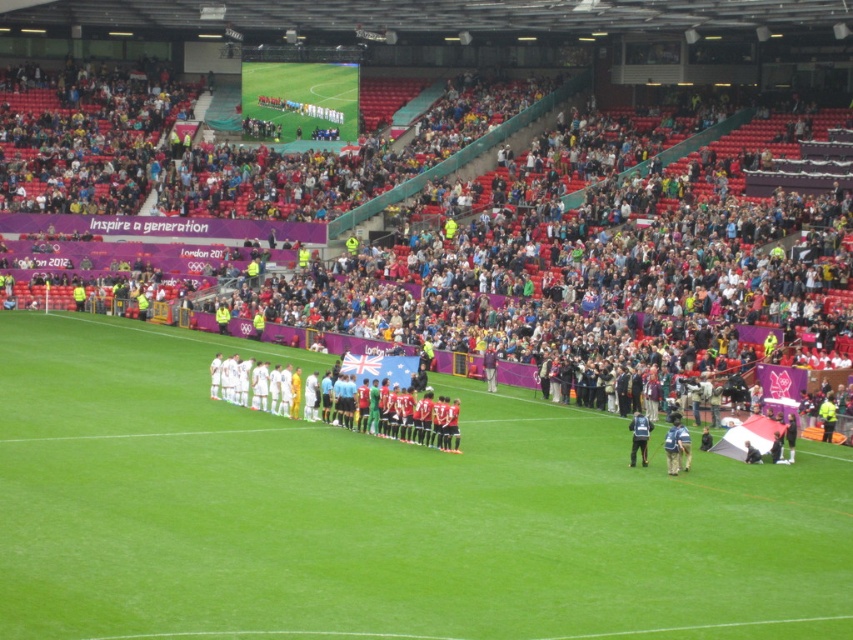
Question: Does green grass football field at center appear under camouflage pants at center?

Choices:
 (A) yes
 (B) no

Answer: (B)

Question: In this image, where is green grass football field at center located relative to camouflage pants at center?

Choices:
 (A) below
 (B) above

Answer: (B)

Question: Which of these objects is positioned closest to the camouflage pants at center?

Choices:
 (A) green grass football field at center
 (B) dark blue backpack at lower right

Answer: (B)

Question: Which object is farther from the camera taking this photo?

Choices:
 (A) dark blue backpack at lower right
 (B) green grass football field at center
 (C) camouflage pants at center

Answer: (A)

Question: From the image, what is the correct spatial relationship of camouflage pants at center in relation to dark blue backpack at lower right?

Choices:
 (A) above
 (B) below

Answer: (A)

Question: Which object is positioned farthest from the dark blue backpack at lower right?

Choices:
 (A) green grass football field at center
 (B) camouflage pants at center

Answer: (A)